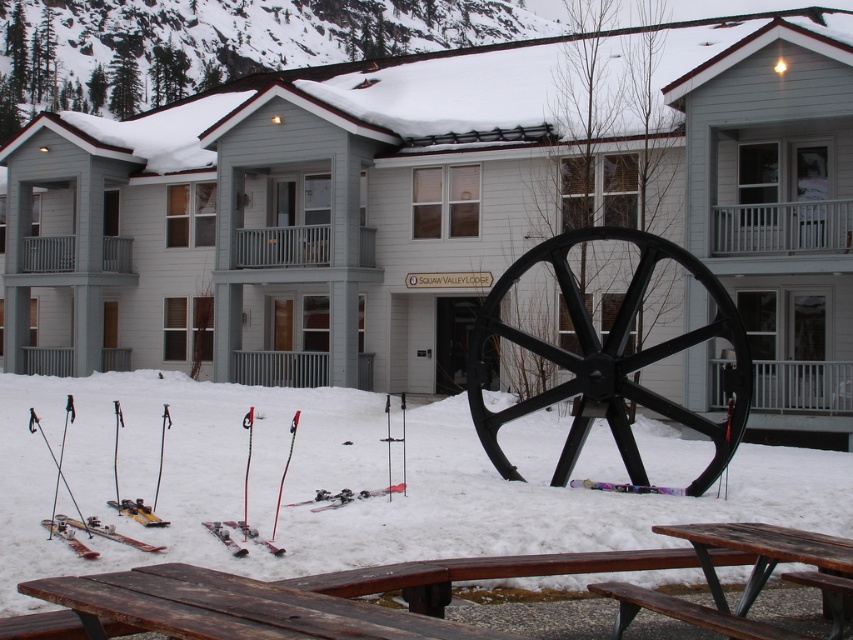
Question: Which of the following is the farthest from the observer?

Choices:
 (A) matte black skis at lower center
 (B) wooden picnic table at lower center

Answer: (A)

Question: Which point is closer to the camera?

Choices:
 (A) (627, 486)
 (B) (230, 520)

Answer: (B)

Question: Can you confirm if dark brown wooden picnic table at lower center is thinner than metallic purple ski at lower center?

Choices:
 (A) yes
 (B) no

Answer: (B)

Question: Does matte black skis at lower left have a larger size compared to metallic purple ski at lower center?

Choices:
 (A) yes
 (B) no

Answer: (A)

Question: Does matte black skis at lower center have a lesser width compared to metallic skis at lower left?

Choices:
 (A) no
 (B) yes

Answer: (B)

Question: Which point is closer to the camera?

Choices:
 (A) matte red ski at lower left
 (B) matte black skis at lower left
 (C) wooden picnic table at lower center

Answer: (C)